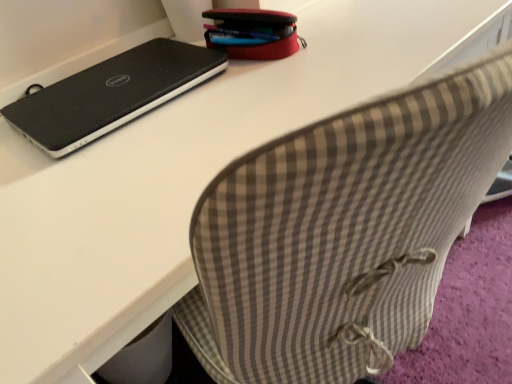
Image resolution: width=512 pixels, height=384 pixels. Describe the element at coordinates (111, 94) in the screenshot. I see `black matte laptop at upper left` at that location.

Where is `black matte laptop at upper left`? Image resolution: width=512 pixels, height=384 pixels. black matte laptop at upper left is located at coordinates (111, 94).

In the scene shown: What is the approximate height of red fabric pencil case at upper center?

red fabric pencil case at upper center is 3.72 inches tall.

Image resolution: width=512 pixels, height=384 pixels. Identify the location of red fabric pencil case at upper center. (253, 33).

The width and height of the screenshot is (512, 384). What do you see at coordinates (253, 33) in the screenshot? I see `red fabric pencil case at upper center` at bounding box center [253, 33].

In order to click on black matte laptop at upper left in this screenshot , I will do `click(111, 94)`.

In the image, is black matte laptop at upper left on the left side or the right side of red fabric pencil case at upper center?

Based on their positions, black matte laptop at upper left is located to the left of red fabric pencil case at upper center.

Who is more distant, black matte laptop at upper left or red fabric pencil case at upper center?

red fabric pencil case at upper center is further away from the camera.

Which is less distant, (177, 64) or (217, 29)?

The point (177, 64) is more forward.

From the image's perspective, is black matte laptop at upper left on red fabric pencil case at upper center?

Actually, black matte laptop at upper left appears below red fabric pencil case at upper center in the image.

From a real-world perspective, is black matte laptop at upper left physically below red fabric pencil case at upper center?

Yes, from a real-world perspective, black matte laptop at upper left is beneath red fabric pencil case at upper center.

Considering the sizes of objects black matte laptop at upper left and red fabric pencil case at upper center in the image provided, who is wider, black matte laptop at upper left or red fabric pencil case at upper center?

black matte laptop at upper left is wider.

From their relative heights in the image, would you say black matte laptop at upper left is taller or shorter than red fabric pencil case at upper center?

In the image, black matte laptop at upper left appears to be shorter than red fabric pencil case at upper center.

Who is bigger, black matte laptop at upper left or red fabric pencil case at upper center?

black matte laptop at upper left is bigger.

Is red fabric pencil case at upper center a part of black matte laptop at upper left?

Result: No, red fabric pencil case at upper center is not inside black matte laptop at upper left.

Is black matte laptop at upper left directly adjacent to red fabric pencil case at upper center?

black matte laptop at upper left and red fabric pencil case at upper center are not in contact.

Could you tell me if black matte laptop at upper left is facing red fabric pencil case at upper center?

No, black matte laptop at upper left is not turned towards red fabric pencil case at upper center.

What's the angular difference between black matte laptop at upper left and red fabric pencil case at upper center's facing directions?

The angular difference between black matte laptop at upper left and red fabric pencil case at upper center is 17.1 degrees.

Where is `laptop below the red fabric pencil case at upper center (from a real-world perspective)`? Image resolution: width=512 pixels, height=384 pixels. laptop below the red fabric pencil case at upper center (from a real-world perspective) is located at coordinates (111, 94).

Is red fabric pencil case at upper center to the left or to the right of black matte laptop at upper left in the image?

Based on their positions, red fabric pencil case at upper center is located to the right of black matte laptop at upper left.

Relative to black matte laptop at upper left, is red fabric pencil case at upper center in front or behind?

red fabric pencil case at upper center is positioned farther from the viewer than black matte laptop at upper left.

Considering the positions of points (249, 55) and (140, 99), is point (249, 55) closer to camera compared to point (140, 99)?

No.

From the image's perspective, is red fabric pencil case at upper center beneath black matte laptop at upper left?

No, from the image's perspective, red fabric pencil case at upper center is not beneath black matte laptop at upper left.

Based on the photo, from a real-world perspective, relative to black matte laptop at upper left, is red fabric pencil case at upper center vertically above or below?

red fabric pencil case at upper center is situated higher than black matte laptop at upper left in the real world.

Is red fabric pencil case at upper center wider or thinner than black matte laptop at upper left?

In the image, red fabric pencil case at upper center appears to be more narrow than black matte laptop at upper left.

From the picture: Who is shorter, red fabric pencil case at upper center or black matte laptop at upper left?

black matte laptop at upper left.

Considering the relative sizes of red fabric pencil case at upper center and black matte laptop at upper left in the image provided, is red fabric pencil case at upper center bigger than black matte laptop at upper left?

No.

Could black matte laptop at upper left be considered to be inside red fabric pencil case at upper center?

Definitely not — black matte laptop at upper left is not inside red fabric pencil case at upper center.

Is the surface of red fabric pencil case at upper center in direct contact with black matte laptop at upper left?

red fabric pencil case at upper center is not next to black matte laptop at upper left, and they're not touching.

Is black matte laptop at upper left at the back of red fabric pencil case at upper center?

red fabric pencil case at upper center is not turned away from black matte laptop at upper left.

How many degrees apart are the facing directions of red fabric pencil case at upper center and black matte laptop at upper left?

The angular difference between red fabric pencil case at upper center and black matte laptop at upper left is 17.1 degrees.

Measure the distance between red fabric pencil case at upper center and black matte laptop at upper left.

A distance of 7.66 inches exists between red fabric pencil case at upper center and black matte laptop at upper left.

The height and width of the screenshot is (384, 512). There is a black matte laptop at upper left. In order to click on pencil case above it (from a real-world perspective) in this screenshot , I will do `click(253, 33)`.

At what (x,y) coordinates should I click in order to perform the action: click on pencil case behind the black matte laptop at upper left. Please return your answer as a coordinate pair (x, y). Looking at the image, I should click on (253, 33).

Where is `pencil case above the black matte laptop at upper left (from the image's perspective)`? The width and height of the screenshot is (512, 384). pencil case above the black matte laptop at upper left (from the image's perspective) is located at coordinates (x=253, y=33).